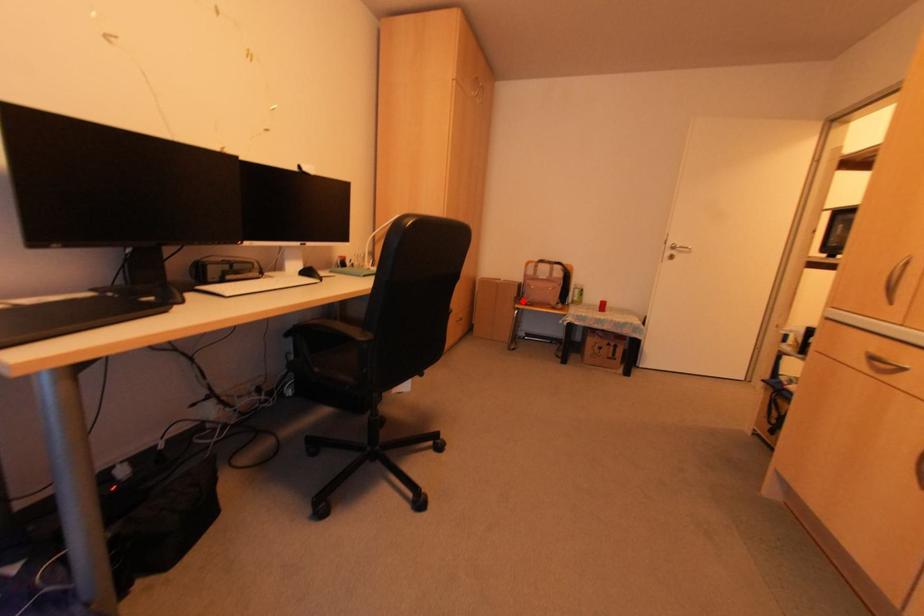
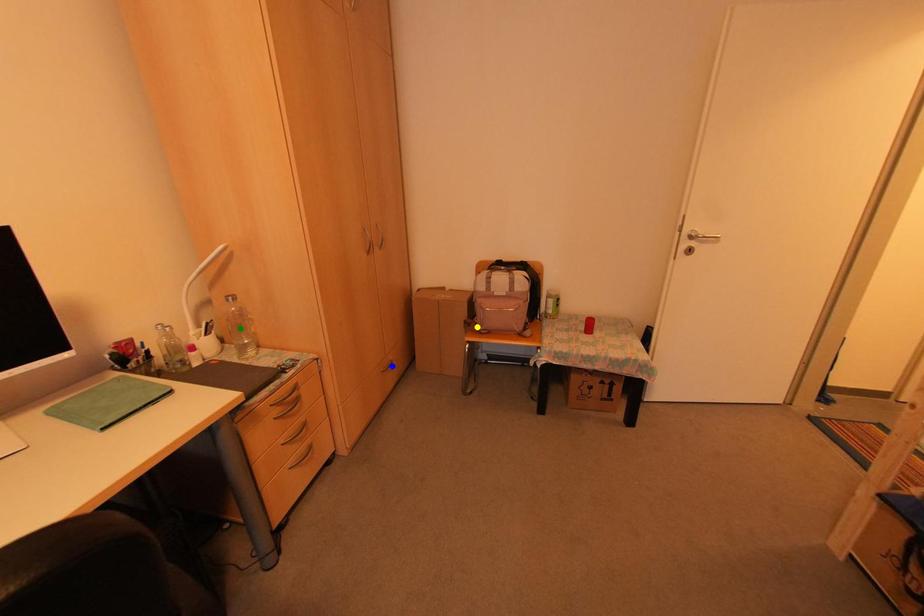
Question: I am providing you with two images of the same scene from different viewpoints. A red point is marked on the first image. You are given multiple points on the second image. Which point in image 2 represents the same 3d spot as the red point in image 1?

Choices:
 (A) blue point
 (B) yellow point
 (C) green point

Answer: (B)